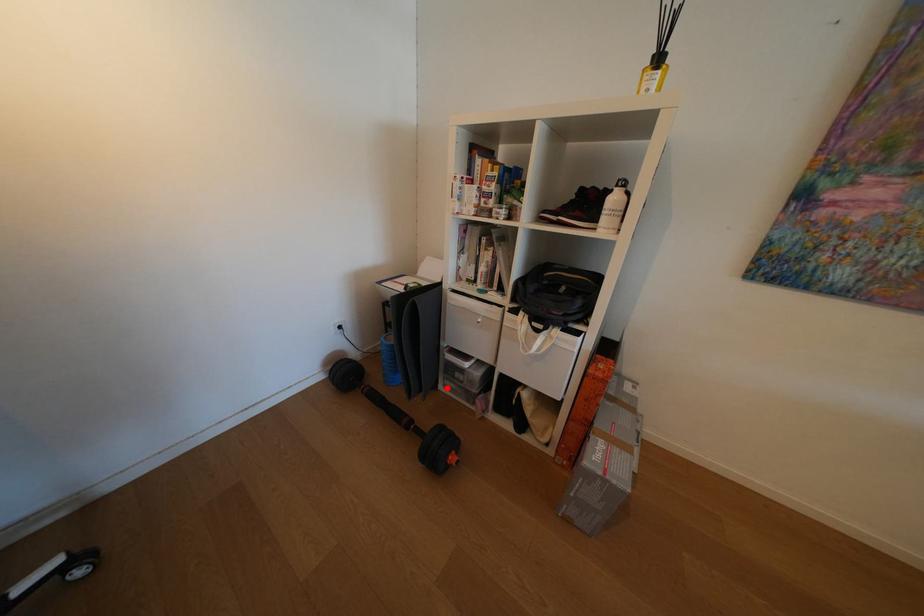
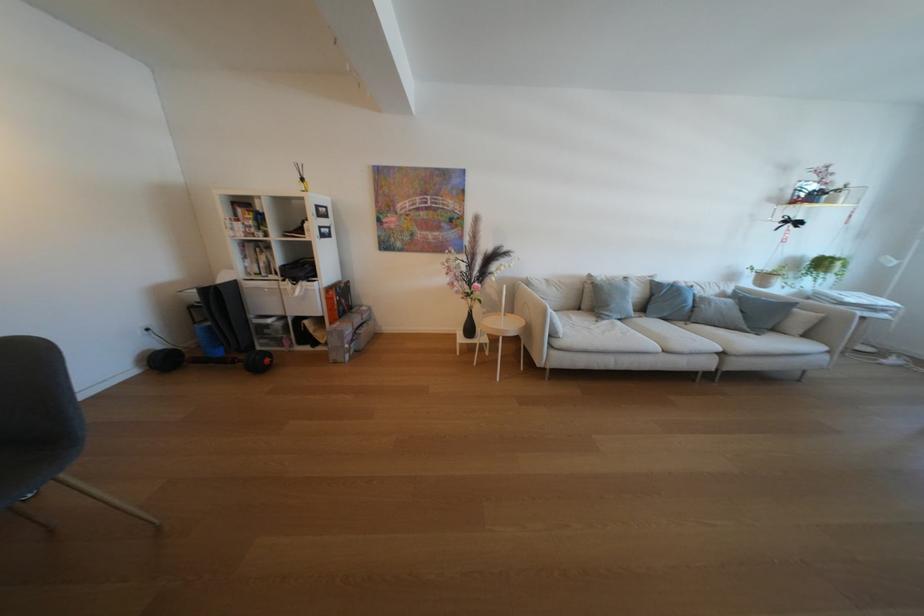
Find the pixel in the second image that matches the highlighted location in the first image.

(265, 351)